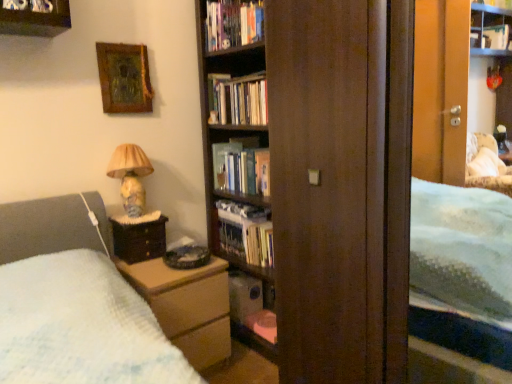
Question: Is hardcover book at center, which appears as the 4th book when ordered from the bottom, to the right of hardcover book at upper center, acting as the 1th book starting from the top, from the viewer's perspective?

Choices:
 (A) no
 (B) yes

Answer: (B)

Question: Is hardcover book at center, which appears as the 4th book when ordered from the bottom, taller than hardcover book at upper center, the 5th book positioned from the bottom?

Choices:
 (A) no
 (B) yes

Answer: (B)

Question: Is hardcover book at center, which appears as the 4th book when ordered from the bottom, positioned with its back to hardcover book at upper center, acting as the 1th book starting from the top?

Choices:
 (A) no
 (B) yes

Answer: (A)

Question: From the image's perspective, is hardcover book at center, which appears as the 4th book when ordered from the bottom, located beneath hardcover book at upper center, acting as the 1th book starting from the top?

Choices:
 (A) yes
 (B) no

Answer: (A)

Question: Does hardcover book at center, which appears as the 4th book when ordered from the bottom, have a lesser width compared to hardcover book at upper center, the 5th book positioned from the bottom?

Choices:
 (A) yes
 (B) no

Answer: (A)

Question: From the image's perspective, is hardcover book at center above or below hardcover book at upper center, acting as the 1th book starting from the top?

Choices:
 (A) above
 (B) below

Answer: (B)

Question: Is point (215, 165) closer or farther from the camera than point (215, 23)?

Choices:
 (A) closer
 (B) farther

Answer: (B)

Question: In terms of width, does hardcover book at center look wider or thinner when compared to hardcover book at upper center, acting as the 1th book starting from the top?

Choices:
 (A) thin
 (B) wide

Answer: (B)

Question: From their relative heights in the image, would you say hardcover book at center is taller or shorter than hardcover book at upper center, acting as the 1th book starting from the top?

Choices:
 (A) tall
 (B) short

Answer: (A)

Question: Is hardcover book at upper center, the 5th book positioned from the bottom, inside the boundaries of hardcover book at center, positioned as the 2th book in bottom-to-top order, or outside?

Choices:
 (A) inside
 (B) outside

Answer: (B)

Question: Based on their sizes in the image, would you say hardcover book at upper center, acting as the 1th book starting from the top, is bigger or smaller than hardcover book at center, positioned as the 2th book in bottom-to-top order?

Choices:
 (A) small
 (B) big

Answer: (A)

Question: Considering the relative positions of hardcover book at upper center, acting as the 1th book starting from the top, and hardcover book at center, which is the 4th book in top-to-bottom order, in the image provided, is hardcover book at upper center, acting as the 1th book starting from the top, to the left or to the right of hardcover book at center, which is the 4th book in top-to-bottom order,?

Choices:
 (A) left
 (B) right

Answer: (A)

Question: From a real-world perspective, is hardcover book at upper center, the 5th book positioned from the bottom, positioned above or below hardcover book at center, which is the 4th book in top-to-bottom order?

Choices:
 (A) above
 (B) below

Answer: (A)

Question: Considering their positions, is hardcover book at upper center, acting as the 1th book starting from the top, located in front of or behind wooden bookcase at center?

Choices:
 (A) behind
 (B) front

Answer: (A)

Question: Does point (250, 6) appear closer or farther from the camera than point (317, 1)?

Choices:
 (A) farther
 (B) closer

Answer: (A)